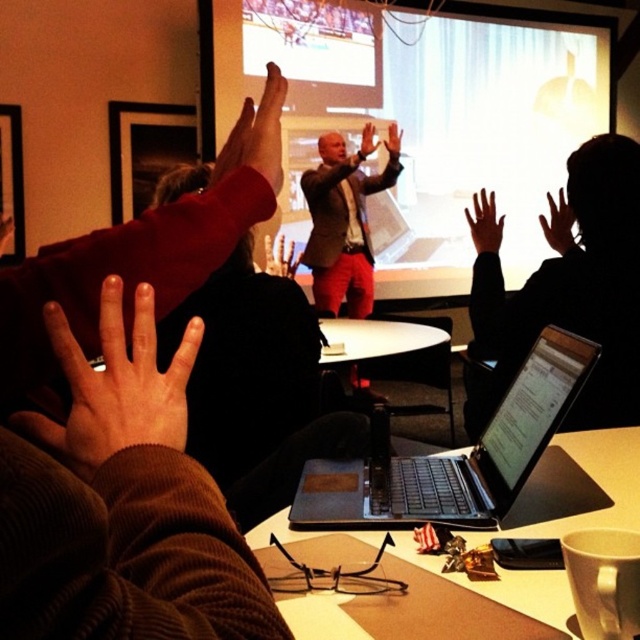
Image resolution: width=640 pixels, height=640 pixels. Find the location of `white matte table at center`. white matte table at center is located at coordinates (595, 481).

Can you confirm if white matte table at center is positioned to the right of smooth skin hand at upper center?

No, white matte table at center is not to the right of smooth skin hand at upper center.

You are a GUI agent. You are given a task and a screenshot of the screen. Output one action in this format:
    pyautogui.click(x=<x>, y=<y>)
    Task: Click on the white matte table at center
    
    Given the screenshot: What is the action you would take?
    click(595, 481)

Between smooth skin hand at upper center and brown leather hand at upper center, which one has more height?

smooth skin hand at upper center is taller.

Does smooth skin hand at upper center have a smaller size compared to brown leather hand at upper center?

Incorrect, smooth skin hand at upper center is not smaller in size than brown leather hand at upper center.

What do you see at coordinates (484, 221) in the screenshot?
I see `smooth skin hand at upper center` at bounding box center [484, 221].

You are a GUI agent. You are given a task and a screenshot of the screen. Output one action in this format:
    pyautogui.click(x=<x>, y=<y>)
    Task: Click on the smooth skin hand at upper center
    
    Given the screenshot: What is the action you would take?
    pyautogui.click(x=484, y=221)

Is matte black laptop at center taller than brown leather hand at center?

No, matte black laptop at center is not taller than brown leather hand at center.

Based on the photo, is matte black laptop at center closer to the viewer compared to brown leather hand at center?

Yes, matte black laptop at center is closer to the viewer.

Is point (477, 464) farther from camera compared to point (273, 266)?

No, it is in front of (273, 266).

The image size is (640, 640). I want to click on matte black laptop at center, so click(531, 412).